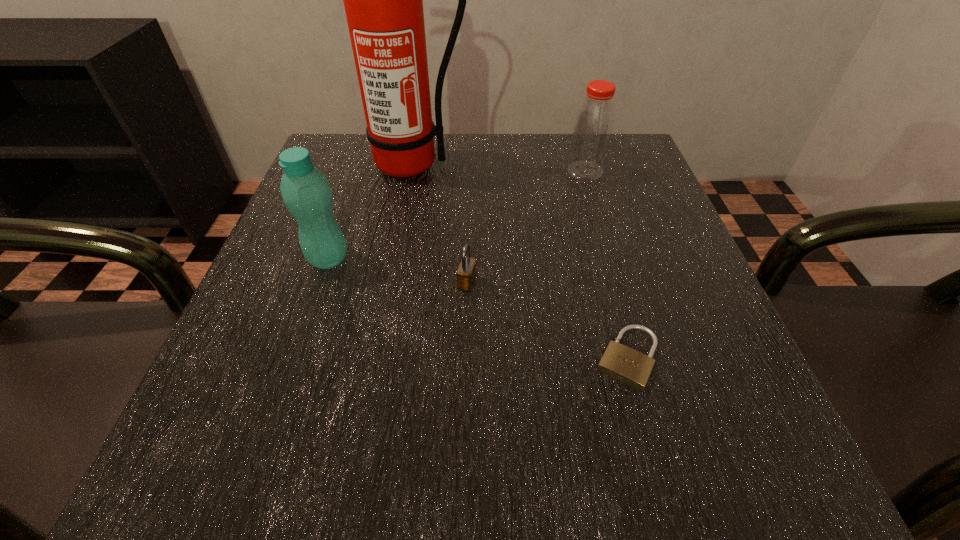
Image resolution: width=960 pixels, height=540 pixels. What are the coordinates of `vacant position located 0.240m on the left of the left padlock` in the screenshot? It's located at (312, 283).

Find the location of a particular element. free space located on the left of the shortest object is located at coordinates point(383,357).

The image size is (960, 540). I want to click on fire extinguisher that is positioned at the far edge, so click(x=383, y=0).

Locate an element on the screen. bottle that is at the far edge is located at coordinates (594, 123).

Where is `fire extinguisher present at the left edge`? The height and width of the screenshot is (540, 960). fire extinguisher present at the left edge is located at coordinates (383, 0).

Locate an element on the screen. The height and width of the screenshot is (540, 960). bottle positioned at the left edge is located at coordinates (305, 190).

You are a GUI agent. You are given a task and a screenshot of the screen. Output one action in this format:
    pyautogui.click(x=<x>, y=<y>)
    Task: Click on the bottle that is at the right edge
    Image resolution: width=960 pixels, height=540 pixels.
    Given the screenshot: What is the action you would take?
    pyautogui.click(x=594, y=123)

Find the location of a particular element. padlock located in the right edge section of the desktop is located at coordinates (631, 367).

I want to click on object that is at the far left corner, so click(383, 0).

Where is `object located in the far right corner section of the desktop`? Image resolution: width=960 pixels, height=540 pixels. object located in the far right corner section of the desktop is located at coordinates (594, 123).